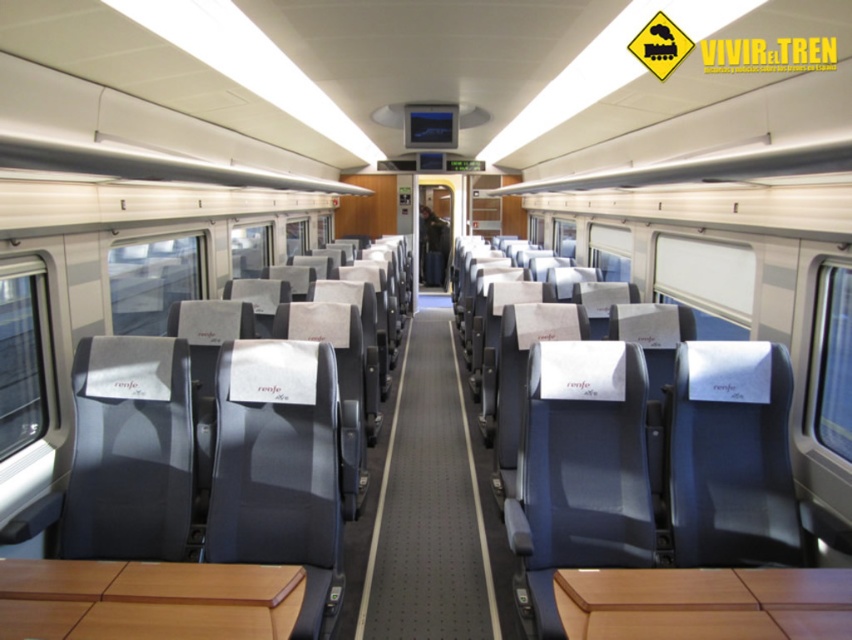
You are a passenger boarding the train and need to find your seat, which is the matte gray seat at center. The gray carpet at center is directly in front of it. Can you walk straight from the entrance to reach your seat without moving sideways?

The gray carpet at center is in front of the matte gray seat at center, so you can walk straight from the entrance towards the gray carpet at center and then reach your seat without needing to move sideways.

You are a passenger on a train and need to place your backpack on the floor. You see the gray carpet at center and the matte gray seat at center. Which object is closer to the floor?

The gray carpet at center is located below the matte gray seat at center, so it is closer to the floor.